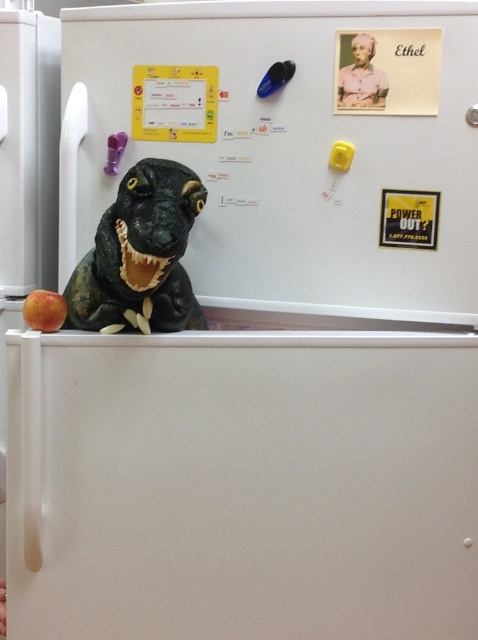
You are organizing the items on the refrigerator. You have a shiny plastic dinosaur at center and a red matte apple at lower left. Which item is located to the right of the other?

The shiny plastic dinosaur at center is positioned on the right side of red matte apple at lower left.

Where is the shiny plastic dinosaur at center located in the image?

The shiny plastic dinosaur at center is located at point (141,252).

You are a child who wants to place a new magnet between the shiny plastic dinosaur at center and the red matte apple at lower left on the refrigerator. The magnet is 10 centimeters wide. Will it fit without overlapping either object?

The distance between the shiny plastic dinosaur at center and the red matte apple at lower left is 12.61 centimeters. Since the magnet is 10 centimeters wide, there is enough space to place it between them without overlapping either object.